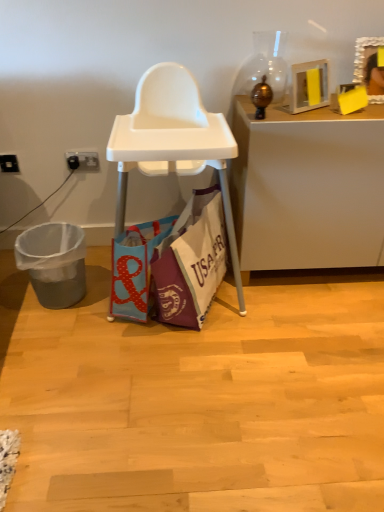
Find the location of a particular element. Image resolution: width=384 pixels, height=512 pixels. free space in front of blue fabric bag at center, which is counted as the 2th handbag, starting from the right is located at coordinates (139, 352).